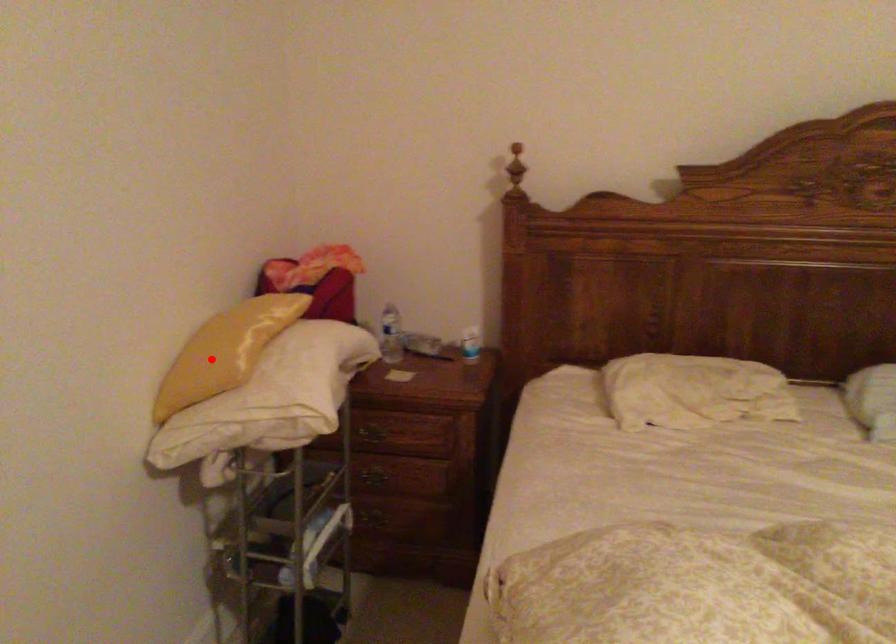
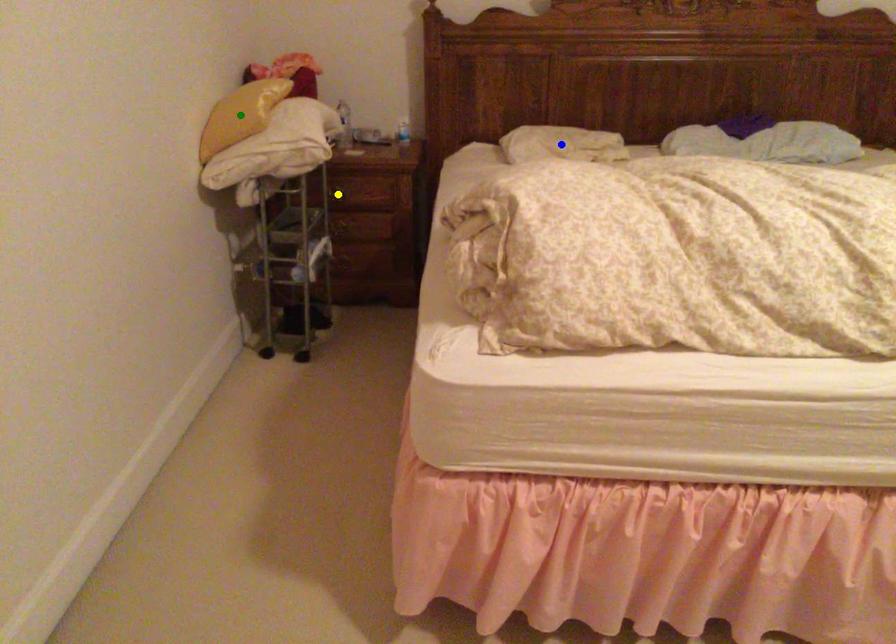
Question: I am providing you with two images of the same scene from different viewpoints. A red point is marked on the first image. You are given multiple points on the second image. Which spot in image 2 lines up with the point in image 1?

Choices:
 (A) green point
 (B) yellow point
 (C) blue point

Answer: (A)